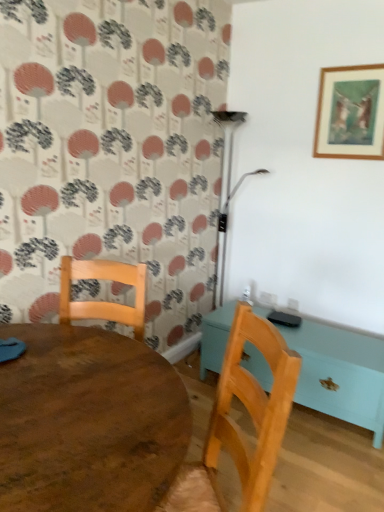
Question: In terms of height, does metallic silver lamp at upper right look taller or shorter compared to wooden table at center, the 1th table from the back?

Choices:
 (A) short
 (B) tall

Answer: (B)

Question: Is metallic silver lamp at upper right situated inside wooden table at center, the 1th table from the back, or outside?

Choices:
 (A) inside
 (B) outside

Answer: (B)

Question: Based on their relative distances, which object is farther from the wooden chair at lower center?

Choices:
 (A) metallic silver lamp at upper right
 (B) wooden table at center, the 1th table from the right
 (C) wooden picture frame at upper right
 (D) wooden table at center, which is the second table in right-to-left order

Answer: (A)

Question: Which of these objects is positioned farthest from the wooden picture frame at upper right?

Choices:
 (A) wooden table at center, the 1th table in the front-to-back sequence
 (B) wooden chair at lower center
 (C) metallic silver lamp at upper right
 (D) wooden table at center, the 1th table from the back

Answer: (A)